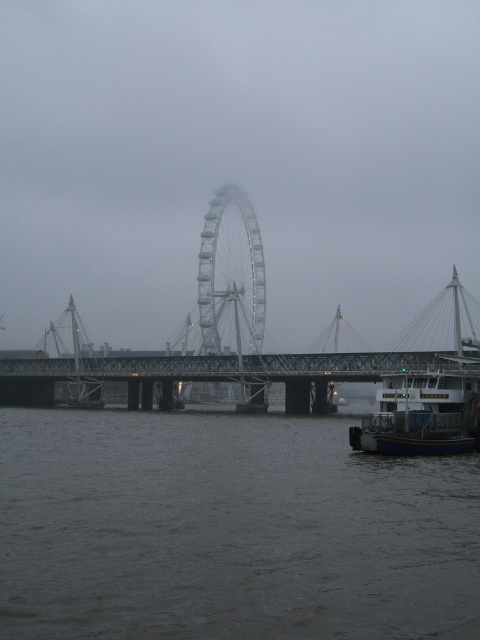
You are standing on the bridge and looking at the Ferris wheel. There are two points marked on the Ferris wheel structure. Which point is closer to you, point (x=90, y=595) or point (x=168, y=406)?

Point (x=90, y=595) is closer to the viewer than point (x=168, y=406).

You are standing at the base of the London Eye Ferris wheel and want to take a photo of the point at coordinates point (305, 412). If your camera has a maximum focus range of 300 feet, will you be able to capture the point clearly?

The point (305, 412) is 334.77 feet away from the camera, which exceeds the maximum focus range of 300 feet. Therefore, the camera will not be able to capture the point clearly.